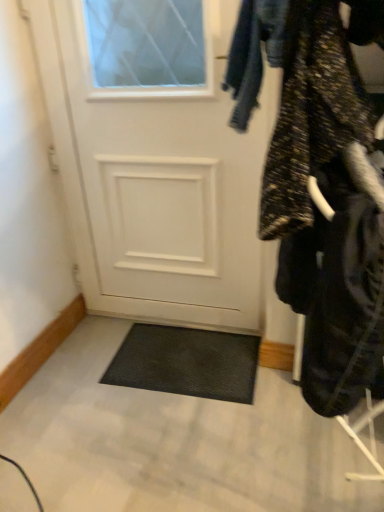
Measure the distance between point (383, 306) and camera.

23.70 inches.

The image size is (384, 512). What do you see at coordinates (328, 201) in the screenshot? I see `textured black coat at right` at bounding box center [328, 201].

Find the location of a particular element. This screenshot has height=512, width=384. textured black coat at right is located at coordinates (328, 201).

Locate an element on the screen. The image size is (384, 512). white matte door at center is located at coordinates (163, 161).

This screenshot has height=512, width=384. Describe the element at coordinates (163, 161) in the screenshot. I see `white matte door at center` at that location.

You are a GUI agent. You are given a task and a screenshot of the screen. Output one action in this format:
    pyautogui.click(x=<x>, y=<y>)
    Task: Click on the textured black coat at right
    The width and height of the screenshot is (384, 512).
    Given the screenshot: What is the action you would take?
    pyautogui.click(x=328, y=201)

Considering the relative positions of textured black coat at right and white matte door at center in the image provided, is textured black coat at right to the right of white matte door at center from the viewer's perspective?

Yes, textured black coat at right is to the right of white matte door at center.

Who is more distant, textured black coat at right or white matte door at center?

Positioned behind is white matte door at center.

Between point (288, 17) and point (103, 1), which one is positioned behind?

The point (103, 1) is farther from the camera.

From the image's perspective, is textured black coat at right positioned above or below white matte door at center?

From the image's perspective, textured black coat at right appears below white matte door at center.

From a real-world perspective, is textured black coat at right located higher than white matte door at center?

Yes, from a real-world perspective, textured black coat at right is on top of white matte door at center.

Which object is wider, textured black coat at right or white matte door at center?

Wider between the two is textured black coat at right.

Who is taller, textured black coat at right or white matte door at center?

white matte door at center.

Considering the sizes of objects textured black coat at right and white matte door at center in the image provided, who is smaller, textured black coat at right or white matte door at center?

With smaller size is white matte door at center.

Is textured black coat at right inside the boundaries of white matte door at center, or outside?

textured black coat at right is not enclosed by white matte door at center.

Is textured black coat at right far from white matte door at center?

No, textured black coat at right is in close proximity to white matte door at center.

Is textured black coat at right facing towards white matte door at center?

No, textured black coat at right is not aimed at white matte door at center.

How different are the orientations of textured black coat at right and white matte door at center in degrees?

The facing directions of textured black coat at right and white matte door at center are 0.675 degrees apart.

At what (x,y) coordinates should I click in order to perform the action: click on door lying on the left of textured black coat at right. Please return your answer as a coordinate pair (x, y). Looking at the image, I should click on (163, 161).

Which object is positioned more to the left, white matte door at center or textured black coat at right?

Positioned to the left is white matte door at center.

Relative to textured black coat at right, is white matte door at center in front or behind?

Visually, white matte door at center is located behind textured black coat at right.

Which point is more forward, (64,64) or (363,97)?

The point (363,97) is closer.

From the image's perspective, is white matte door at center above or below textured black coat at right?

white matte door at center is situated higher than textured black coat at right in the image.

Consider the image. From a real-world perspective, between white matte door at center and textured black coat at right, who is vertically lower?

From a 3D spatial view, white matte door at center is below.

Is white matte door at center wider than textured black coat at right?

No.

Considering the relative sizes of white matte door at center and textured black coat at right in the image provided, is white matte door at center shorter than textured black coat at right?

No, white matte door at center is not shorter than textured black coat at right.

Considering the sizes of objects white matte door at center and textured black coat at right in the image provided, who is smaller, white matte door at center or textured black coat at right?

Smaller between the two is white matte door at center.

Is white matte door at center not inside textured black coat at right?

Yes, white matte door at center is located beyond the bounds of textured black coat at right.

Would you consider white matte door at center to be distant from textured black coat at right?

They are positioned close to each other.

Is white matte door at center oriented away from textured black coat at right?

white matte door at center is not turned away from textured black coat at right.

How different are the orientations of white matte door at center and textured black coat at right in degrees?

0.675 degrees separate the facing orientations of white matte door at center and textured black coat at right.

How distant is white matte door at center from textured black coat at right?

81.16 centimeters.

At what (x,y) coordinates should I click in order to perform the action: click on door below the textured black coat at right (from a real-world perspective). Please return your answer as a coordinate pair (x, y). Looking at the image, I should click on (163, 161).

Where is `closet below the white matte door at center (from the image's perspective)`? closet below the white matte door at center (from the image's perspective) is located at coordinates (328, 201).

Find the location of `closet that is in front of the white matte door at center`. closet that is in front of the white matte door at center is located at coordinates (328, 201).